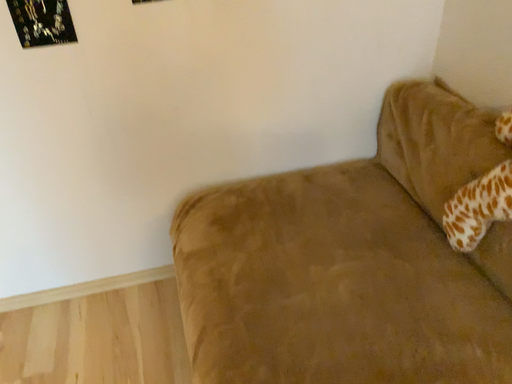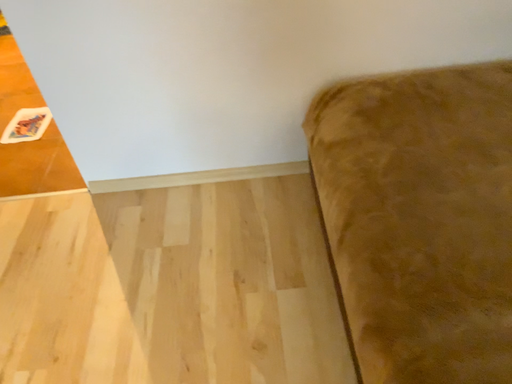
Question: Which way did the camera rotate in the video?

Choices:
 (A) rotated left
 (B) rotated right

Answer: (A)